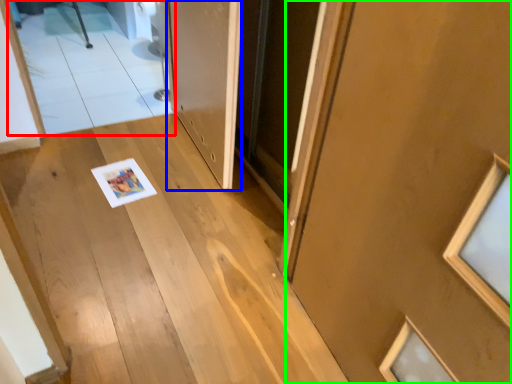
Question: Considering the real-world distances, which object is closest to mirror (highlighted by a red box)? door (highlighted by a blue box) or door (highlighted by a green box).

Choices:
 (A) door
 (B) door

Answer: (A)